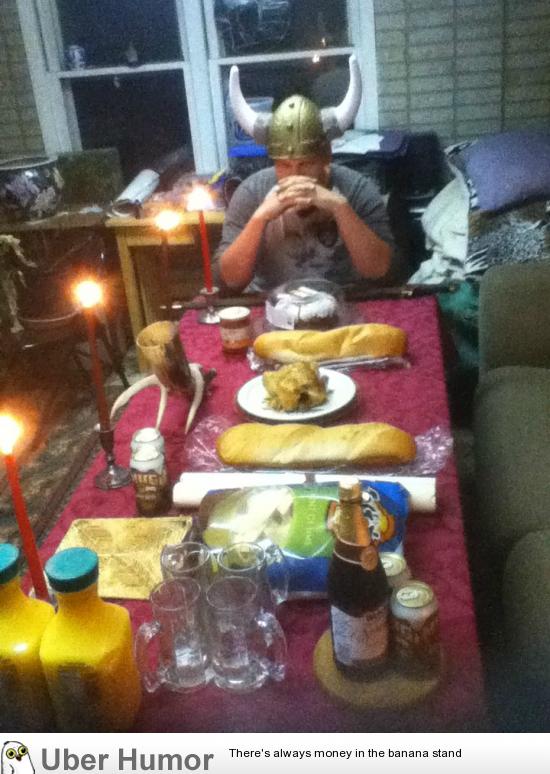
Where is `mugs`? This screenshot has width=550, height=774. mugs is located at coordinates (239, 632), (190, 627), (199, 553), (236, 556).